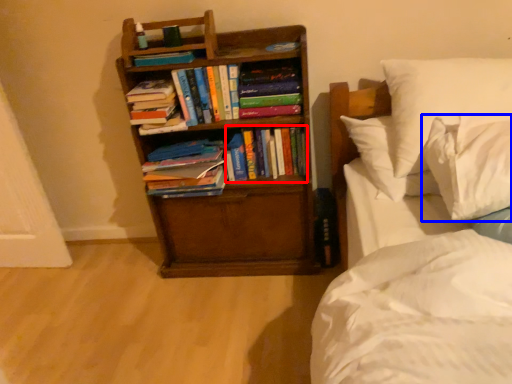
Question: Which point is closer to the camera, book (highlighted by a red box) or pillow (highlighted by a blue box)?

Choices:
 (A) book
 (B) pillow

Answer: (B)